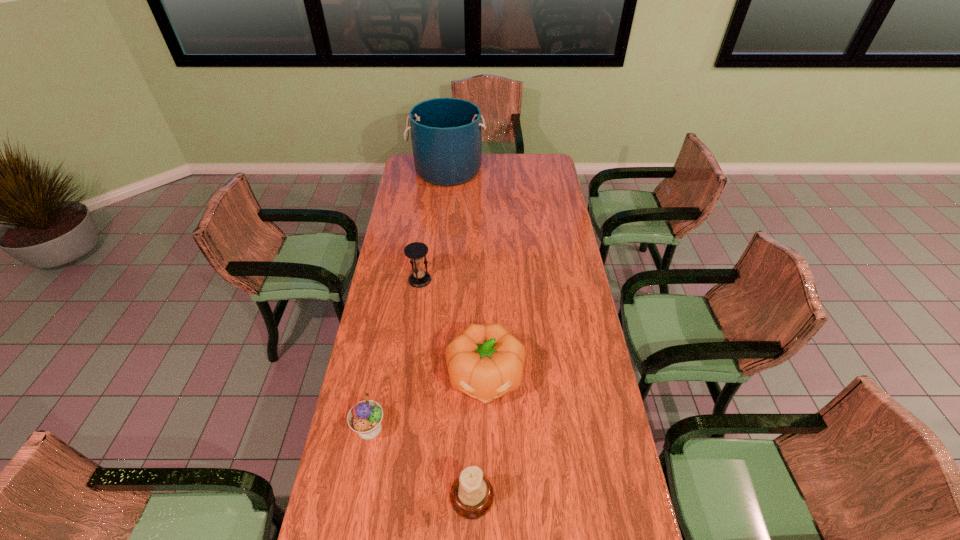
You are a GUI agent. You are given a task and a screenshot of the screen. Output one action in this format:
    pyautogui.click(x=<x>, y=<y>)
    Task: Click on the free space between the hourglass and the nearest object
    The width and height of the screenshot is (960, 540).
    Given the screenshot: What is the action you would take?
    pyautogui.click(x=445, y=388)

Find the location of a particular element. The width and height of the screenshot is (960, 540). free spot between the icecream and the candle holder is located at coordinates (420, 462).

Where is `free space between the candle holder and the second tallest object`? free space between the candle holder and the second tallest object is located at coordinates (478, 436).

The image size is (960, 540). In order to click on vacant area that lies between the fourth nearest object and the candle holder in this screenshot , I will do `click(445, 388)`.

This screenshot has height=540, width=960. Find the location of `free spot between the second farthest object and the candle holder`. free spot between the second farthest object and the candle holder is located at coordinates (445, 388).

Where is `free space between the nearest object and the fourth nearest object`? Image resolution: width=960 pixels, height=540 pixels. free space between the nearest object and the fourth nearest object is located at coordinates (445, 388).

You are a GUI agent. You are given a task and a screenshot of the screen. Output one action in this format:
    pyautogui.click(x=<x>, y=<y>)
    Task: Click on the vacant point located between the second tallest object and the shortest object
    The image size is (960, 540).
    Given the screenshot: What is the action you would take?
    pyautogui.click(x=427, y=402)

Identify the location of free space between the farthest object and the candle holder. The width and height of the screenshot is (960, 540). (460, 333).

This screenshot has width=960, height=540. Find the location of `free space between the tallest object and the hourglass`. free space between the tallest object and the hourglass is located at coordinates (434, 225).

Where is `vacant region between the fourth shortest object and the bucket`? This screenshot has height=540, width=960. vacant region between the fourth shortest object and the bucket is located at coordinates (467, 274).